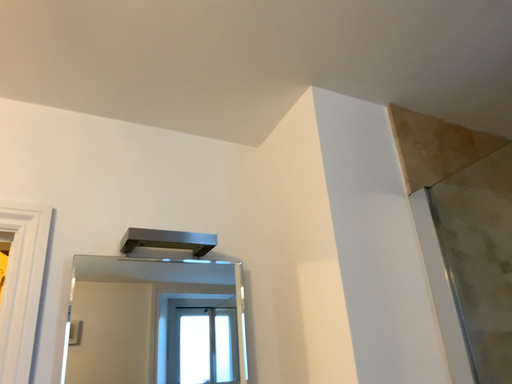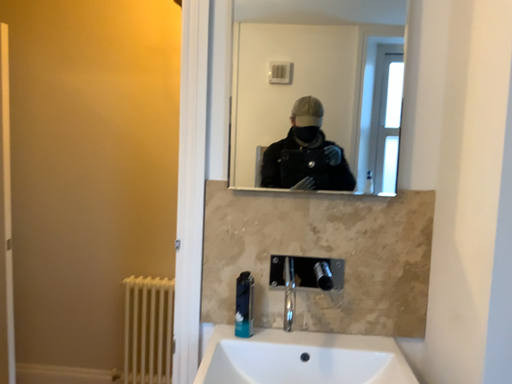
Question: How did the camera likely rotate when shooting the video?

Choices:
 (A) rotated left
 (B) rotated right

Answer: (A)